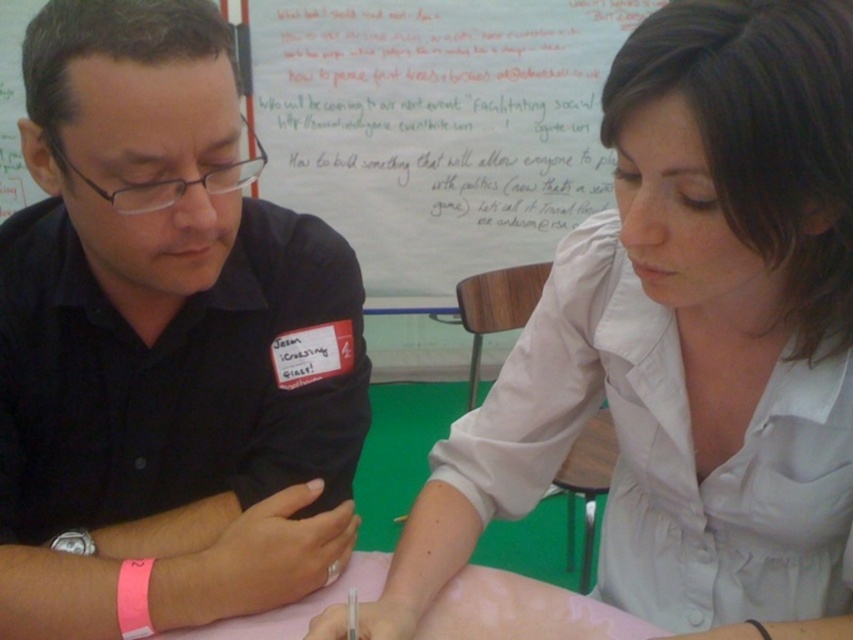
Question: Which of the following is the closest to the observer?

Choices:
 (A) black shirt at left
 (B) light beige shirt at center
 (C) white paperboard at upper center
 (D) pink paper at center

Answer: (B)

Question: Is black shirt at left above white paperboard at upper center?

Choices:
 (A) yes
 (B) no

Answer: (B)

Question: Which of the following is the farthest from the observer?

Choices:
 (A) (15, 484)
 (B) (517, 444)
 (C) (524, 252)

Answer: (C)

Question: Considering the real-world distances, which object is closest to the light beige shirt at center?

Choices:
 (A) black shirt at left
 (B) white paperboard at upper center

Answer: (A)

Question: Is white paperboard at upper center above pink paper at center?

Choices:
 (A) yes
 (B) no

Answer: (A)

Question: Can you confirm if white paperboard at upper center is thinner than pink paper at center?

Choices:
 (A) no
 (B) yes

Answer: (A)